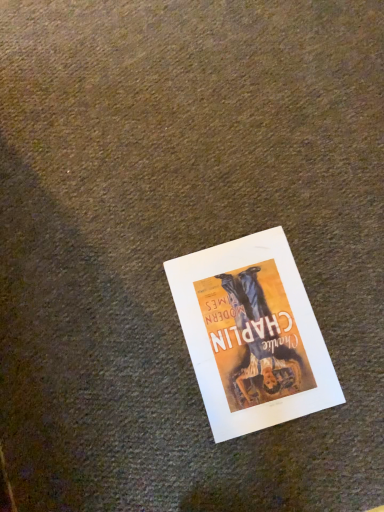
This screenshot has height=512, width=384. What are the coordinates of `vacant space underneath white paper poster at center (from a real-world perspective)` in the screenshot? It's located at (250, 328).